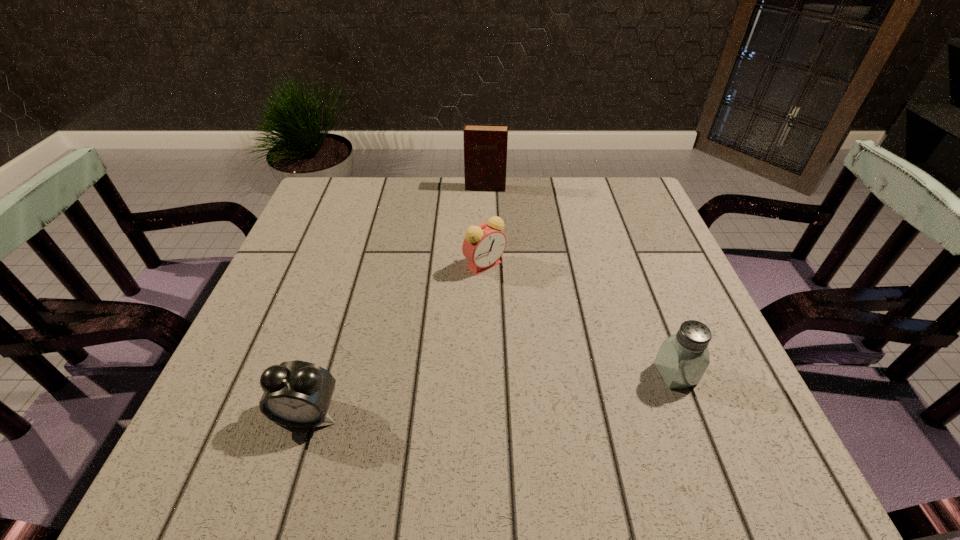
At what (x,y) coordinates should I click in order to perform the action: click on free spot that satisfies the following two spatial constraints: 1. on the front side of the tallest object; 2. on the right side of the second nearest object. Please return your answer as a coordinate pair (x, y). The image size is (960, 540). Looking at the image, I should click on (489, 374).